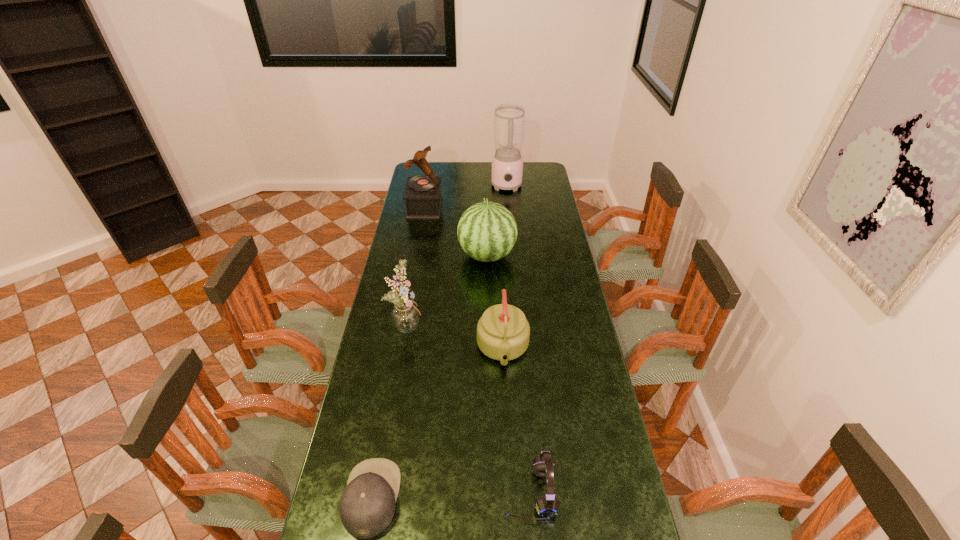
The height and width of the screenshot is (540, 960). Find the location of `free space at the right edge of the desktop`. free space at the right edge of the desktop is located at coordinates (564, 458).

The height and width of the screenshot is (540, 960). Identify the location of blank space at the far right corner of the desktop. (525, 164).

Locate an element on the screen. free space between the headset and the watermelon is located at coordinates (508, 374).

At what (x,y) coordinates should I click in order to perform the action: click on free space between the phonograph_record and the farthest object. Please return your answer as a coordinate pair (x, y). The width and height of the screenshot is (960, 540). Looking at the image, I should click on (466, 198).

The image size is (960, 540). Identify the location of vacant area that lies between the third shortest object and the farthest object. [x=505, y=268].

Identify the location of empty space between the food processor and the fifth tallest object. point(505,268).

Select which object is the third closest to the bouquet. Please provide its 2D coordinates. Your answer should be formatted as a tuple, i.e. [(x, y)], where the tuple contains the x and y coordinates of a point satisfying the conditions above.

[(367, 505)]

Select which object appears as the second closest to the bouquet. Please provide its 2D coordinates. Your answer should be formatted as a tuple, i.e. [(x, y)], where the tuple contains the x and y coordinates of a point satisfying the conditions above.

[(487, 231)]

Image resolution: width=960 pixels, height=540 pixels. What are the coordinates of `vacant area that satisfies the following two spatial constraints: 1. at the horn opening of the phonograph_record; 2. on the right side of the third farthest object` in the screenshot? It's located at (417, 255).

The width and height of the screenshot is (960, 540). Find the location of `free spot that satisfies the following two spatial constraints: 1. on the back side of the watermelon; 2. at the horn opening of the phonograph_record`. free spot that satisfies the following two spatial constraints: 1. on the back side of the watermelon; 2. at the horn opening of the phonograph_record is located at coordinates (486, 208).